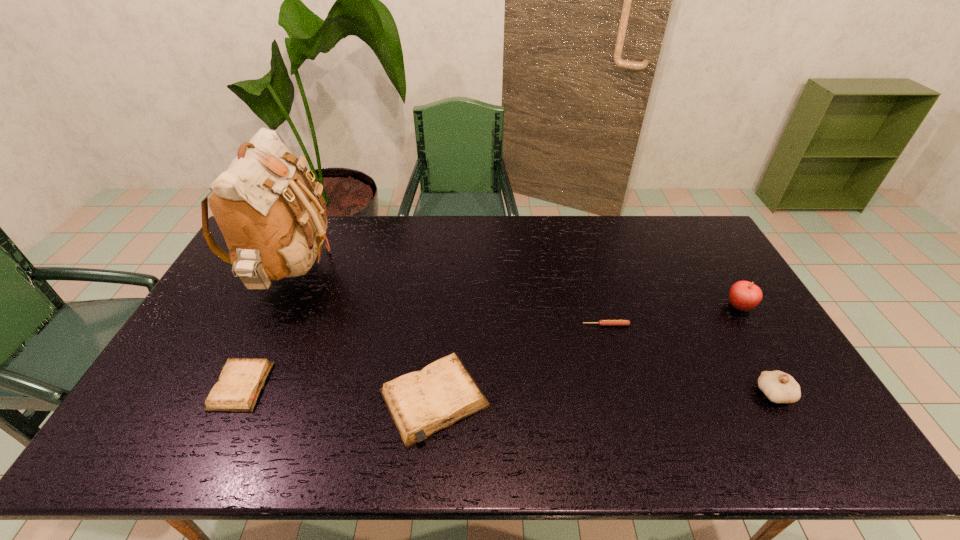
Image resolution: width=960 pixels, height=540 pixels. What are the coordinates of `garlic located in the right edge section of the desktop` in the screenshot? It's located at (779, 387).

Image resolution: width=960 pixels, height=540 pixels. What are the coordinates of `object located at the far left corner` in the screenshot? It's located at (273, 225).

Identify the location of object located in the near left corner section of the desktop. Image resolution: width=960 pixels, height=540 pixels. (240, 383).

At what (x,y) coordinates should I click in order to perform the action: click on object present at the near right corner. Please return your answer as a coordinate pair (x, y). The width and height of the screenshot is (960, 540). Looking at the image, I should click on (779, 387).

Locate an element on the screen. free region at the far edge is located at coordinates (384, 252).

Identify the location of free region at the near edge of the desktop. (637, 389).

Locate an element on the screen. Image resolution: width=960 pixels, height=540 pixels. free space at the left edge is located at coordinates (229, 269).

In the image, there is a desktop. Identify the location of free space at the right edge. This screenshot has height=540, width=960. (711, 306).

In the image, there is a desktop. Find the location of `vacant space at the near left corner`. vacant space at the near left corner is located at coordinates (203, 395).

Locate an element on the screen. This screenshot has height=540, width=960. vacant space at the far right corner of the desktop is located at coordinates (695, 230).